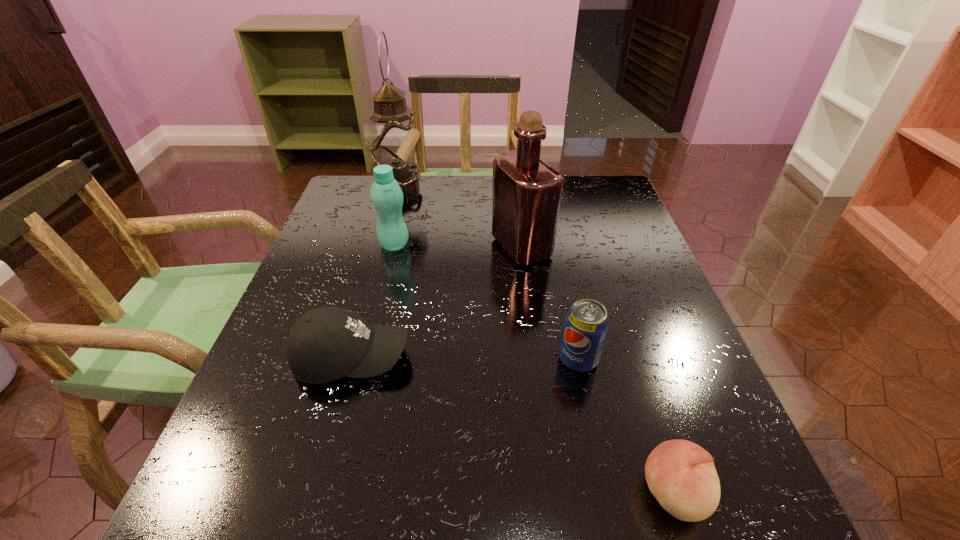
At what (x,y) coordinates should I click in order to perform the action: click on free space that is in between the liquor and the farthest object. Please return your answer as a coordinate pair (x, y). The image size is (960, 540). Looking at the image, I should click on (461, 218).

At what (x,y) coordinates should I click in order to perform the action: click on empty space that is in between the second tallest object and the nearest object. Please return your answer as a coordinate pair (x, y). The height and width of the screenshot is (540, 960). Looking at the image, I should click on (597, 370).

This screenshot has height=540, width=960. I want to click on vacant area that lies between the liquor and the nearest object, so (x=597, y=370).

Find the location of `free space that is in between the fourth shortest object and the second tallest object`. free space that is in between the fourth shortest object and the second tallest object is located at coordinates (458, 246).

Where is `vacant space in between the soda and the farthest object`? vacant space in between the soda and the farthest object is located at coordinates (490, 274).

Image resolution: width=960 pixels, height=540 pixels. I want to click on free spot between the soda and the third tallest object, so (487, 302).

This screenshot has width=960, height=540. In order to click on the fourth closest object relative to the oil lamp in this screenshot , I will do `click(586, 324)`.

Find the location of a particular element. The width and height of the screenshot is (960, 540). object that stands as the fifth closest to the liquor is located at coordinates [681, 475].

Locate an element on the screen. free point that satisfies the following two spatial constraints: 1. on the front-facing side of the fifth tallest object; 2. on the right side of the soda is located at coordinates (351, 359).

Locate an element on the screen. This screenshot has width=960, height=540. vacant point that satisfies the following two spatial constraints: 1. on the front side of the oil lamp; 2. on the front-facing side of the baseball cap is located at coordinates 354,358.